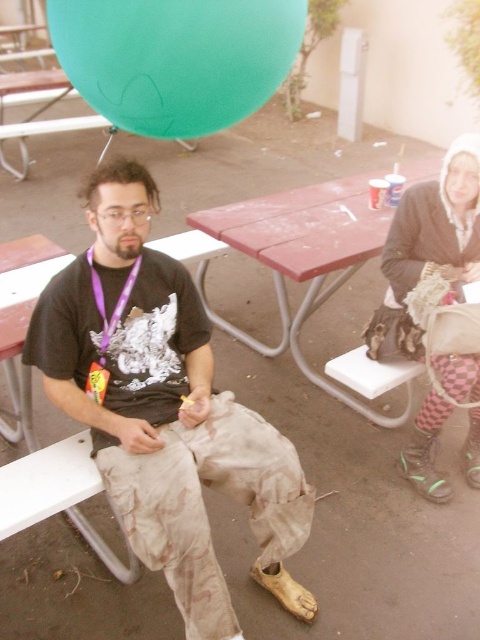
Does white plastic picnic table at left have a lesser height compared to purple fabric lanyard at center?

No, white plastic picnic table at left is not shorter than purple fabric lanyard at center.

Between point (12, 275) and point (103, 308), which one is positioned behind?

Point (12, 275)

Where is `white plastic picnic table at left`? The height and width of the screenshot is (640, 480). white plastic picnic table at left is located at coordinates pyautogui.click(x=23, y=321).

Who is more forward, (158, 289) or (20, 380)?

Point (158, 289) is more forward.

Which is above, camouflage pants at center or white plastic picnic table at left?

white plastic picnic table at left is higher up.

Is point (236, 422) closer to viewer compared to point (36, 241)?

Yes, point (236, 422) is in front of point (36, 241).

This screenshot has height=640, width=480. I want to click on camouflage pants at center, so click(164, 408).

Is red plastic picnic table at center taller than purple fabric lanyard at center?

Yes, red plastic picnic table at center is taller than purple fabric lanyard at center.

Which is in front, point (218, 228) or point (95, 381)?

Point (95, 381)

Is point (204, 301) behind point (115, 317)?

Yes, point (204, 301) is farther from viewer.

This screenshot has width=480, height=640. I want to click on red plastic picnic table at center, so click(302, 259).